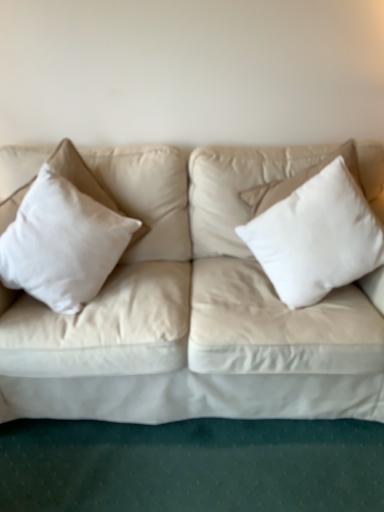
Question: Can you confirm if white cotton pillow at left, which ranks as the first pillow in left-to-right order, is positioned to the right of white soft pillow at right, placed as the 1th pillow when sorted from right to left?

Choices:
 (A) yes
 (B) no

Answer: (B)

Question: Does white cotton pillow at left, which ranks as the first pillow in left-to-right order, have a greater height compared to white soft pillow at right, positioned as the 2th pillow in left-to-right order?

Choices:
 (A) yes
 (B) no

Answer: (B)

Question: Is white cotton pillow at left, acting as the 2th pillow starting from the right, facing away from white soft pillow at right, placed as the 1th pillow when sorted from right to left?

Choices:
 (A) yes
 (B) no

Answer: (B)

Question: Is white cotton pillow at left, which ranks as the first pillow in left-to-right order, closer to the viewer compared to white soft pillow at right, placed as the 1th pillow when sorted from right to left?

Choices:
 (A) no
 (B) yes

Answer: (B)

Question: Is white soft pillow at right, positioned as the 2th pillow in left-to-right order, inside white cotton pillow at left, which ranks as the first pillow in left-to-right order?

Choices:
 (A) no
 (B) yes

Answer: (A)

Question: From a real-world perspective, is white cotton pillow at left, acting as the 2th pillow starting from the right, located higher than white soft pillow at right, placed as the 1th pillow when sorted from right to left?

Choices:
 (A) no
 (B) yes

Answer: (A)

Question: Is white soft pillow at right, placed as the 1th pillow when sorted from right to left, shorter than white cotton pillow at left, which ranks as the first pillow in left-to-right order?

Choices:
 (A) yes
 (B) no

Answer: (B)

Question: Is white soft pillow at right, positioned as the 2th pillow in left-to-right order, outside white cotton pillow at left, acting as the 2th pillow starting from the right?

Choices:
 (A) no
 (B) yes

Answer: (B)

Question: Is white soft pillow at right, positioned as the 2th pillow in left-to-right order, facing towards white cotton pillow at left, acting as the 2th pillow starting from the right?

Choices:
 (A) no
 (B) yes

Answer: (A)

Question: From a real-world perspective, is white soft pillow at right, placed as the 1th pillow when sorted from right to left, positioned over white cotton pillow at left, which ranks as the first pillow in left-to-right order, based on gravity?

Choices:
 (A) no
 (B) yes

Answer: (B)

Question: Is white soft pillow at right, placed as the 1th pillow when sorted from right to left, closer to the viewer compared to white cotton pillow at left, acting as the 2th pillow starting from the right?

Choices:
 (A) yes
 (B) no

Answer: (B)

Question: Is white soft pillow at right, positioned as the 2th pillow in left-to-right order, next to white cotton pillow at left, acting as the 2th pillow starting from the right?

Choices:
 (A) yes
 (B) no

Answer: (B)

Question: Is white soft pillow at right, placed as the 1th pillow when sorted from right to left, wider or thinner than white cotton pillow at left, which ranks as the first pillow in left-to-right order?

Choices:
 (A) wide
 (B) thin

Answer: (B)